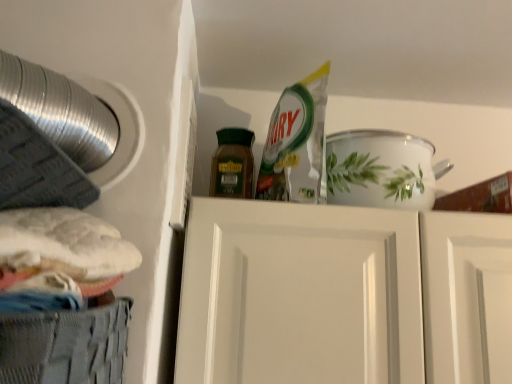
Question: Can you confirm if brown matte jar at center is taller than white glossy door at center?

Choices:
 (A) no
 (B) yes

Answer: (A)

Question: Is brown matte jar at center closer to camera compared to white glossy door at center?

Choices:
 (A) no
 (B) yes

Answer: (A)

Question: Does brown matte jar at center turn towards white glossy door at center?

Choices:
 (A) no
 (B) yes

Answer: (A)

Question: From the image's perspective, does brown matte jar at center appear lower than white glossy door at center?

Choices:
 (A) no
 (B) yes

Answer: (A)

Question: From the image's perspective, is brown matte jar at center on top of white glossy door at center?

Choices:
 (A) no
 (B) yes

Answer: (B)

Question: Would you say white glossy door at center is to the left or to the right of gray mesh basket at lower left in the picture?

Choices:
 (A) left
 (B) right

Answer: (B)

Question: From their relative heights in the image, would you say white glossy door at center is taller or shorter than gray mesh basket at lower left?

Choices:
 (A) short
 (B) tall

Answer: (B)

Question: Considering the positions of white glossy door at center and gray mesh basket at lower left in the image, is white glossy door at center wider or thinner than gray mesh basket at lower left?

Choices:
 (A) wide
 (B) thin

Answer: (A)

Question: From a real-world perspective, is white glossy door at center physically located above or below gray mesh basket at lower left?

Choices:
 (A) below
 (B) above

Answer: (B)

Question: In terms of height, does brown matte jar at center look taller or shorter compared to white glossy door at center?

Choices:
 (A) short
 (B) tall

Answer: (A)

Question: From the image's perspective, relative to white glossy door at center, is brown matte jar at center above or below?

Choices:
 (A) above
 (B) below

Answer: (A)

Question: Does point (223, 185) appear closer or farther from the camera than point (291, 327)?

Choices:
 (A) closer
 (B) farther

Answer: (B)

Question: Looking at the image, does brown matte jar at center seem bigger or smaller compared to white glossy door at center?

Choices:
 (A) small
 (B) big

Answer: (A)

Question: From the image's perspective, is gray mesh basket at lower left located above or below white glossy door at center?

Choices:
 (A) below
 (B) above

Answer: (B)

Question: From a real-world perspective, is gray mesh basket at lower left above or below white glossy door at center?

Choices:
 (A) below
 (B) above

Answer: (A)